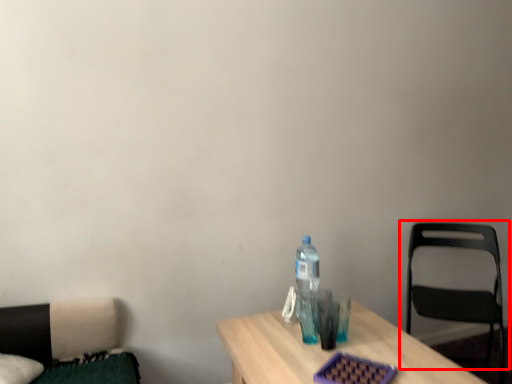
Question: Considering the relative positions of chair (annotated by the red box) and bottle in the image provided, where is chair (annotated by the red box) located with respect to the staircase?

Choices:
 (A) left
 (B) right

Answer: (B)